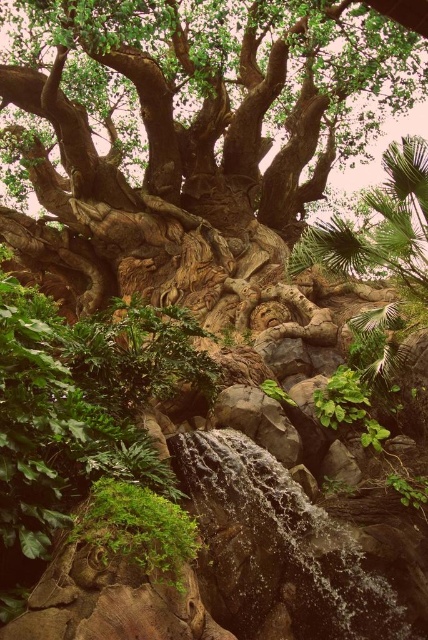
Question: Which of the following is the farthest from the observer?

Choices:
 (A) (216, 461)
 (B) (338, 104)

Answer: (B)

Question: Does green rough bark tree at center have a greater width compared to green mossy rock at lower left?

Choices:
 (A) no
 (B) yes

Answer: (B)

Question: Can you confirm if green rough bark tree at center is wider than green mossy rock at lower left?

Choices:
 (A) yes
 (B) no

Answer: (A)

Question: Which point appears closest to the camera in this image?

Choices:
 (A) (154, 513)
 (B) (255, 154)
 (C) (270, 422)
 (D) (415, 577)

Answer: (A)

Question: Which of the following is the farthest from the observer?

Choices:
 (A) green rough bark tree at center
 (B) clear water at center
 (C) green mossy rock at lower left

Answer: (B)

Question: Is green mossy rock at lower left bigger than rocky waterfall at center?

Choices:
 (A) yes
 (B) no

Answer: (B)